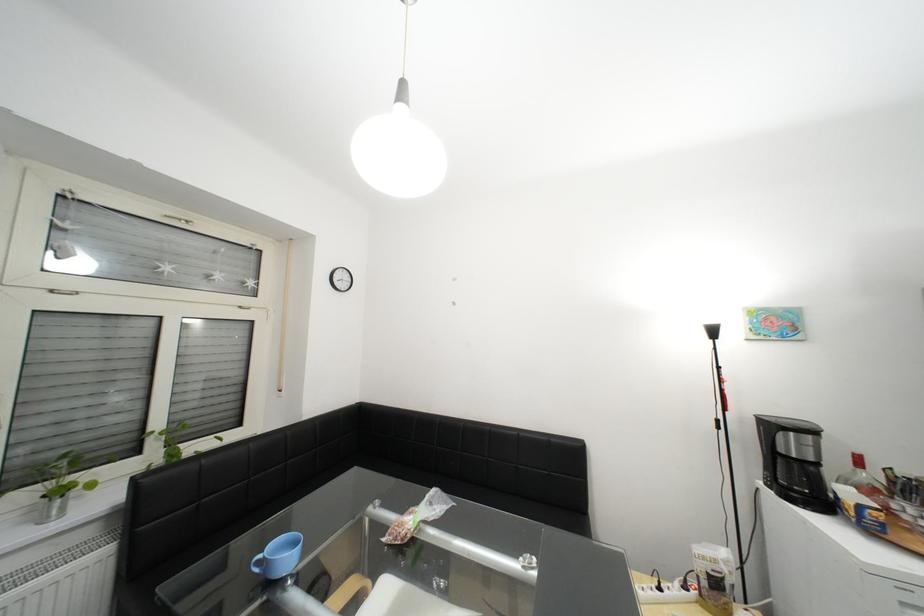
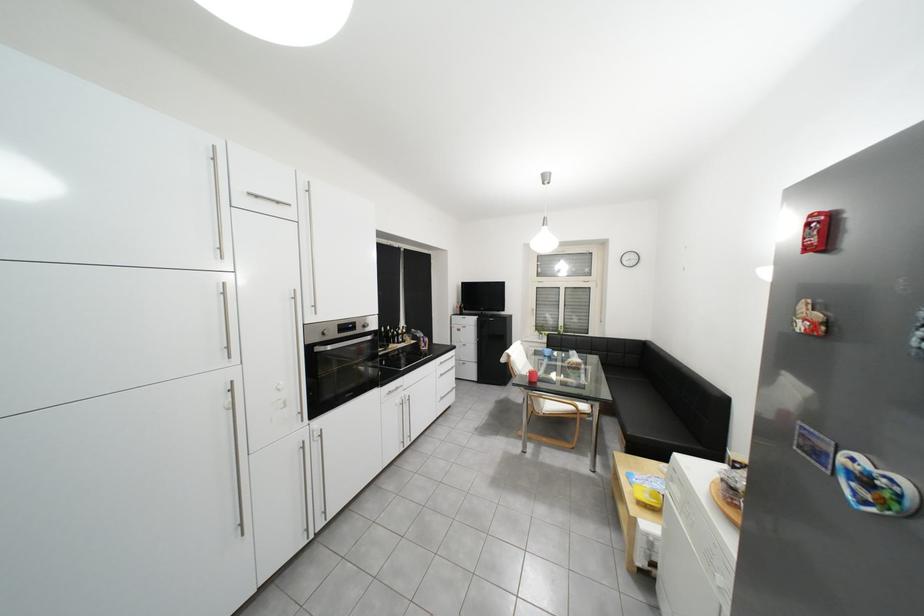
Question: I am providing you with two images of the same scene from different viewpoints. Please identify which objects are invisible in image2.

Choices:
 (A) paintbrush handle
 (B) silver oven handle
 (C) white power strip
 (D) chair sitting surface

Answer: (C)